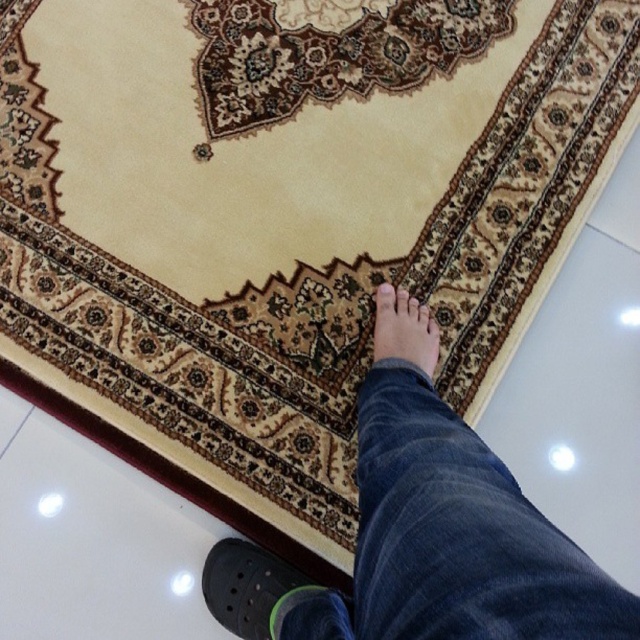
Question: Which of the following is the farthest from the observer?

Choices:
 (A) (392, 332)
 (B) (406, 308)

Answer: (B)

Question: Which object is farther from the camera taking this photo?

Choices:
 (A) denim jeans at center
 (B) blue fabric sock at lower center
 (C) matte brown toe at center
 (D) matte black foot at lower center

Answer: (C)

Question: In this image, where is black rubber croc at lower left located relative to matte brown toe at center?

Choices:
 (A) left
 (B) right

Answer: (A)

Question: Is blue fabric sock at lower center below matte brown toe at center?

Choices:
 (A) yes
 (B) no

Answer: (A)

Question: Considering the real-world distances, which object is closest to the denim jeans at center?

Choices:
 (A) matte brown toe at center
 (B) blue fabric sock at lower center
 (C) black rubber croc at lower left

Answer: (B)

Question: Does blue fabric sock at lower center appear over matte brown toe at center?

Choices:
 (A) yes
 (B) no

Answer: (B)